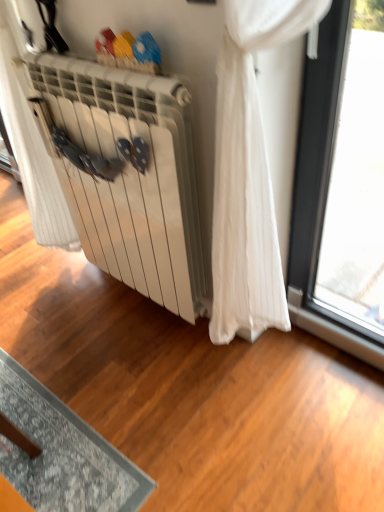
Question: Which is correct: white sheer curtain at center is inside white matte radiator at center, or outside of it?

Choices:
 (A) inside
 (B) outside

Answer: (B)

Question: Visually, is white sheer curtain at center positioned to the left or to the right of white matte radiator at center?

Choices:
 (A) right
 (B) left

Answer: (B)

Question: Is white sheer curtain at center bigger or smaller than white matte radiator at center?

Choices:
 (A) big
 (B) small

Answer: (A)

Question: Does point (160, 260) appear closer or farther from the camera than point (26, 125)?

Choices:
 (A) closer
 (B) farther

Answer: (A)

Question: From a real-world perspective, is white matte radiator at center physically located above or below white sheer curtain at center?

Choices:
 (A) above
 (B) below

Answer: (B)

Question: From the image's perspective, is white matte radiator at center positioned above or below white sheer curtain at center?

Choices:
 (A) above
 (B) below

Answer: (B)

Question: In the image, is white matte radiator at center positioned in front of or behind white sheer curtain at center?

Choices:
 (A) front
 (B) behind

Answer: (A)